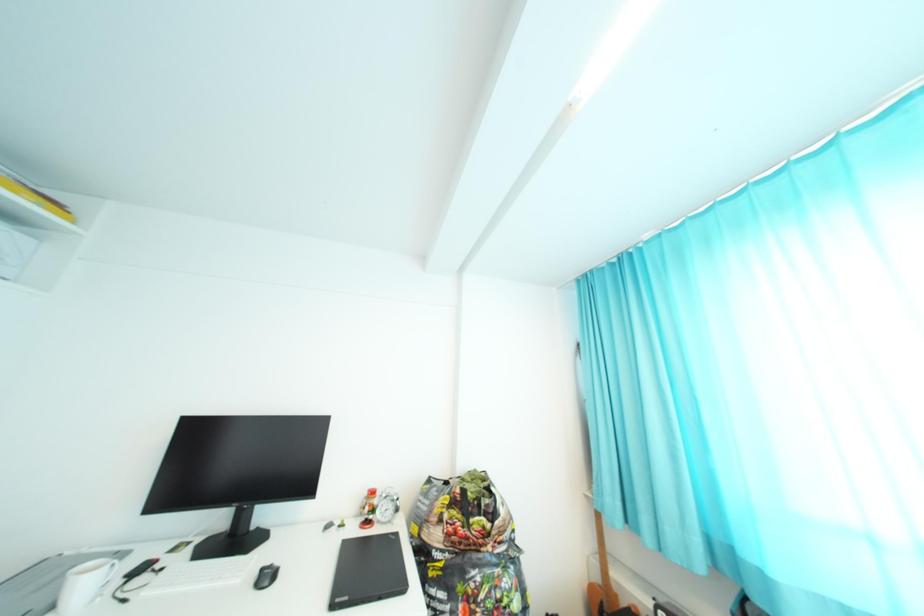
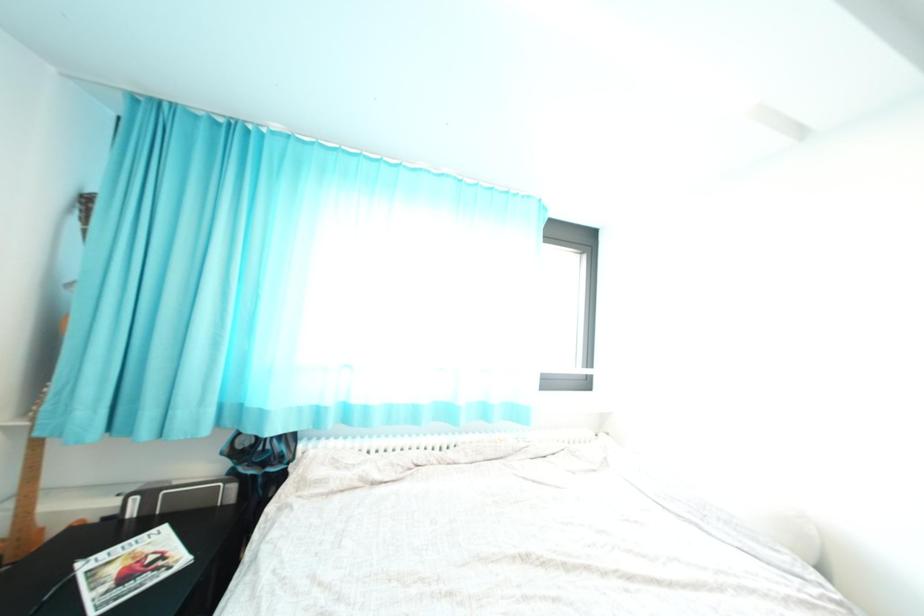
Question: The camera is either moving clockwise (left) or counter-clockwise (right) around the object. The first image is from the beginning of the video and the second image is from the end. Is the camera moving left or right when shooting the video?

Choices:
 (A) Left
 (B) Right

Answer: (A)